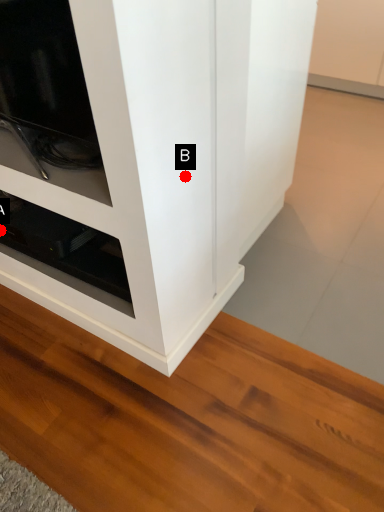
Question: Two points are circled on the image, labeled by A and B beside each circle. Which point is closer to the camera?

Choices:
 (A) A is closer
 (B) B is closer

Answer: (B)